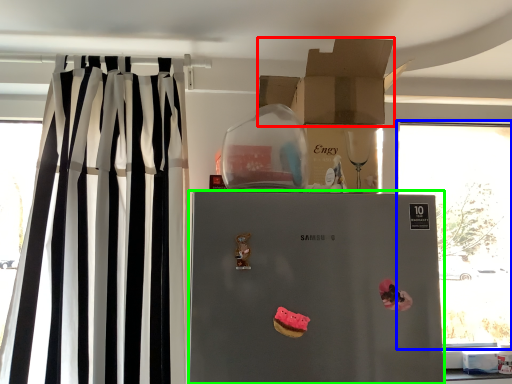
Question: Considering the real-world distances, which object is farthest from cardboard box (highlighted by a red box)? window (highlighted by a blue box) or refrigerator (highlighted by a green box)?

Choices:
 (A) window
 (B) refrigerator

Answer: (A)